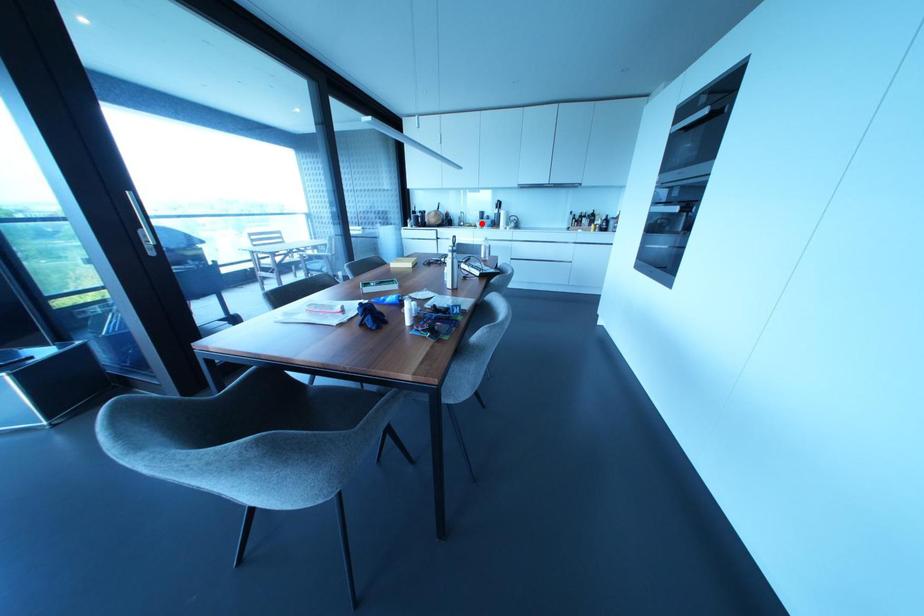
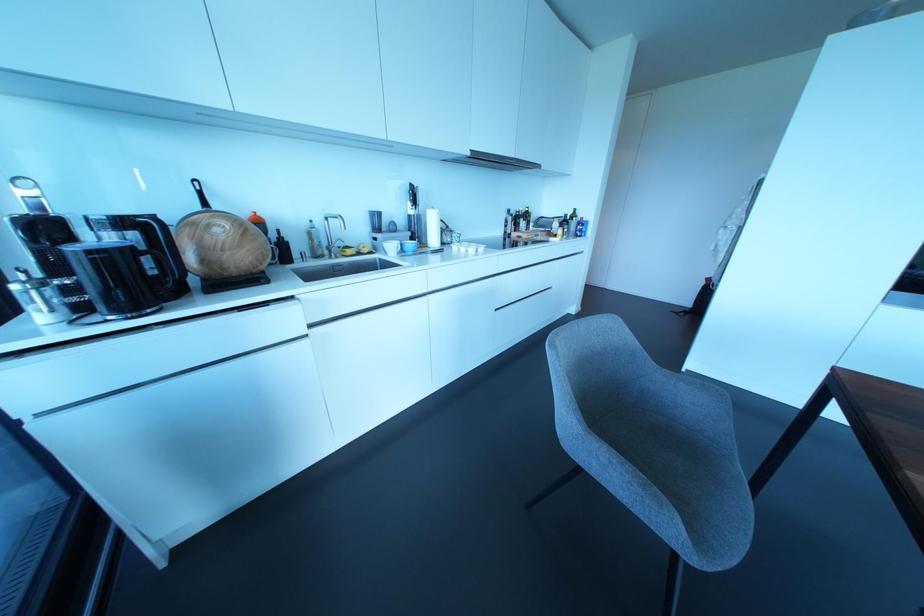
Find the pixel in the second image that matches the highlighted location in the first image.

(400, 244)